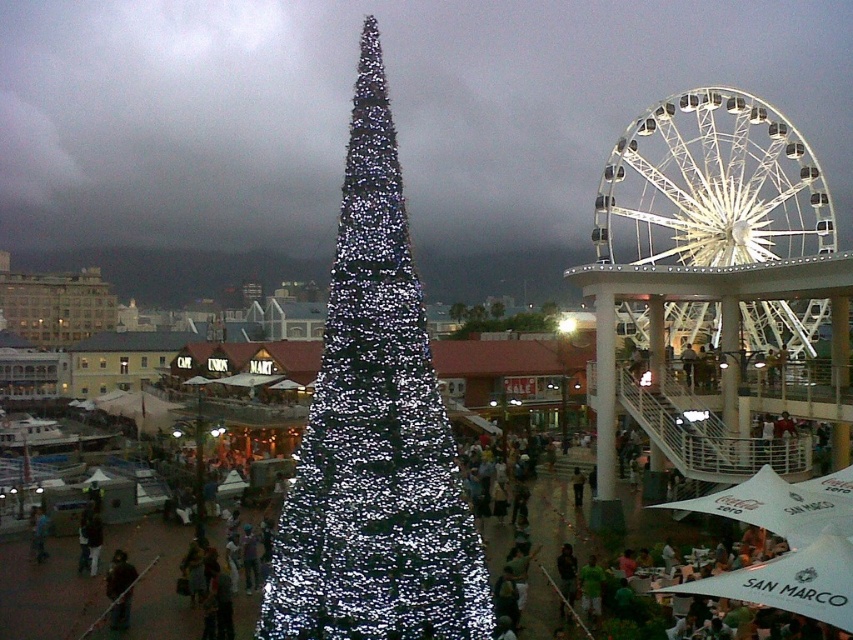
Question: Which point is farther to the camera?

Choices:
 (A) white metallic ferris wheel at upper right
 (B) illuminated plastic tree at center
 (C) iridescent metallic christmas tree at center
 (D) dark brown leather jacket at lower left

Answer: (B)

Question: Based on their relative distances, which object is nearer to the dark brown leather jacket at lower left?

Choices:
 (A) iridescent metallic christmas tree at center
 (B) illuminated plastic tree at center
 (C) white metallic ferris wheel at upper right

Answer: (A)

Question: Which object is positioned farthest from the dark brown leather jacket at lower left?

Choices:
 (A) white metallic ferris wheel at upper right
 (B) illuminated plastic tree at center
 (C) iridescent metallic christmas tree at center

Answer: (B)

Question: Can you confirm if white metallic ferris wheel at upper right is positioned above illuminated plastic tree at center?

Choices:
 (A) no
 (B) yes

Answer: (B)

Question: Does iridescent metallic christmas tree at center have a lesser width compared to dark brown leather jacket at lower left?

Choices:
 (A) no
 (B) yes

Answer: (A)

Question: Is iridescent metallic christmas tree at center closer to the viewer compared to dark brown leather jacket at lower left?

Choices:
 (A) yes
 (B) no

Answer: (A)